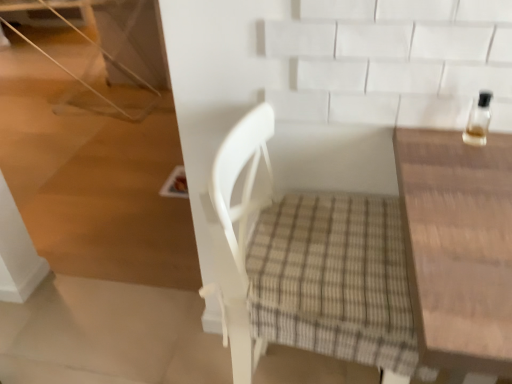
What do you see at coordinates (306, 266) in the screenshot? This screenshot has width=512, height=384. I see `white woven chair at center` at bounding box center [306, 266].

Find the location of a particular element. wooden table at right is located at coordinates (458, 247).

Are wooden table at right and white woven chair at center located far from each other?

No, there isn't a large distance between wooden table at right and white woven chair at center.

From the image's perspective, which one is positioned higher, wooden table at right or white woven chair at center?

white woven chair at center is shown above in the image.

Considering the sizes of objects wooden table at right and white woven chair at center in the image provided, who is shorter, wooden table at right or white woven chair at center?

Standing shorter between the two is wooden table at right.

Based on their sizes in the image, would you say wooden table at right is bigger or smaller than white woven chair at center?

In the image, wooden table at right appears to be larger than white woven chair at center.

Is white woven chair at center facing towards clear glass bottle at upper right?

Yes.

Is point (359, 280) farther from viewer compared to point (484, 144)?

No.

Considering the sizes of objects white woven chair at center and clear glass bottle at upper right in the image provided, who is thinner, white woven chair at center or clear glass bottle at upper right?

Thinner between the two is clear glass bottle at upper right.

Does white woven chair at center lie behind clear glass bottle at upper right?

No.

Is clear glass bottle at upper right located outside wooden table at right?

Yes.

Is clear glass bottle at upper right taller or shorter than wooden table at right?

In the image, clear glass bottle at upper right appears to be shorter than wooden table at right.

Can you confirm if clear glass bottle at upper right is thinner than wooden table at right?

Yes, clear glass bottle at upper right is thinner than wooden table at right.

Is point (478, 117) more distant than point (472, 206)?

Yes, point (478, 117) is farther from viewer.

Does white woven chair at center have a larger size compared to wooden table at right?

Actually, white woven chair at center might be smaller than wooden table at right.

From a real-world perspective, is white woven chair at center physically above wooden table at right?

Correct, in the physical world, white woven chair at center is higher than wooden table at right.

From the image's perspective, which is below, white woven chair at center or wooden table at right?

From the image's view, wooden table at right is below.

Is white woven chair at center in contact with wooden table at right?

No, white woven chair at center is not making contact with wooden table at right.

The image size is (512, 384). I want to click on chair that appears on the left of clear glass bottle at upper right, so click(x=306, y=266).

Considering the sizes of clear glass bottle at upper right and white woven chair at center in the image, is clear glass bottle at upper right bigger or smaller than white woven chair at center?

clear glass bottle at upper right is smaller than white woven chair at center.

Is clear glass bottle at upper right turned away from white woven chair at center?

No, clear glass bottle at upper right is not facing the opposite direction of white woven chair at center.

Is clear glass bottle at upper right closer to the viewer compared to white woven chair at center?

No, it is not.

Find the location of `bottle lying behind the wooden table at right`. bottle lying behind the wooden table at right is located at coordinates click(x=478, y=120).

Is wooden table at right far from clear glass bottle at upper right?

Actually, wooden table at right and clear glass bottle at upper right are a little close together.

Could you tell me if wooden table at right is facing clear glass bottle at upper right?

No.

Locate an element on the screen. chair lying above the wooden table at right (from the image's perspective) is located at coordinates (306, 266).

Find the location of a particular element. The height and width of the screenshot is (384, 512). chair that appears below the clear glass bottle at upper right (from the image's perspective) is located at coordinates (306, 266).

Consider the image. Considering their positions, is wooden table at right positioned closer to clear glass bottle at upper right than white woven chair at center?

The object closer to clear glass bottle at upper right is wooden table at right.

Looking at the image, which one is located closer to wooden table at right, clear glass bottle at upper right or white woven chair at center?

clear glass bottle at upper right is positioned closer to the anchor wooden table at right.

Looking at the image, which one is located closer to wooden table at right, white woven chair at center or clear glass bottle at upper right?

Among the two, clear glass bottle at upper right is located nearer to wooden table at right.

From the image, which object appears to be farther from white woven chair at center, clear glass bottle at upper right or wooden table at right?

clear glass bottle at upper right is positioned further to the anchor white woven chair at center.

Looking at the image, which one is located closer to clear glass bottle at upper right, white woven chair at center or wooden table at right?

wooden table at right is closer to clear glass bottle at upper right.

When comparing their distances from white woven chair at center, does wooden table at right or clear glass bottle at upper right seem further?

Based on the image, clear glass bottle at upper right appears to be further to white woven chair at center.

Identify the location of chair between clear glass bottle at upper right and wooden table at right in the up-down direction. tap(306, 266).